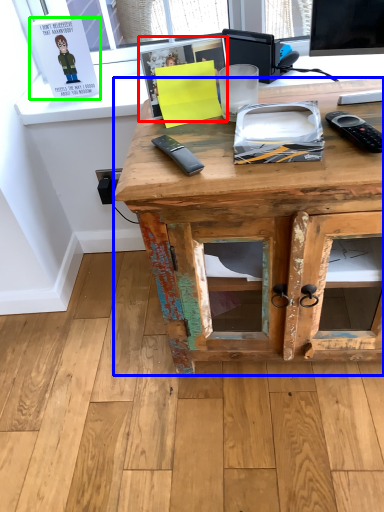
Question: Which object is the farthest from book (highlighted by a red box)? Choose among these: desk (highlighted by a blue box) or book (highlighted by a green box).

Choices:
 (A) desk
 (B) book

Answer: (B)